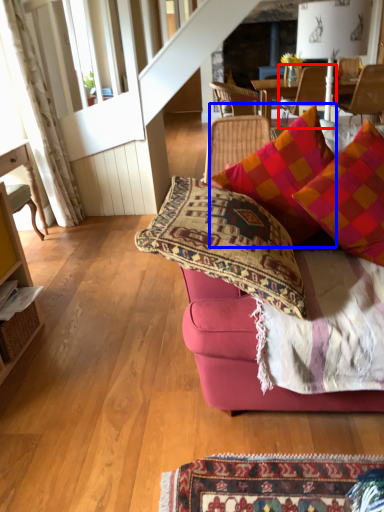
Question: Which point is closer to the camera, chair (highlighted by a red box) or pillow (highlighted by a blue box)?

Choices:
 (A) chair
 (B) pillow

Answer: (B)